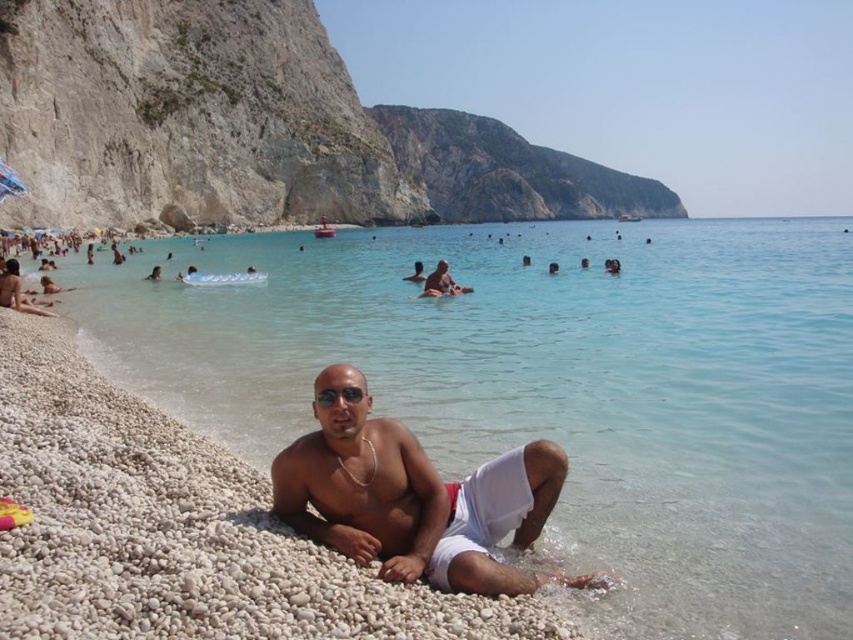
You are standing at the position of the man on the pebbles and want to reach the clear blue water at center. In which direction should you move to get there?

The clear blue water at center is located at point coordinates, so you should move towards the center direction from your current position on the pebbles.

You are a photographer taking a picture of the beach scene. You want to focus on the clear blue water at center and the white cotton shorts at lower center. Which object is nearer to the camera lens?

The clear blue water at center is closer to the viewer than the white cotton shorts at lower center, so the water will be nearer to the camera lens.